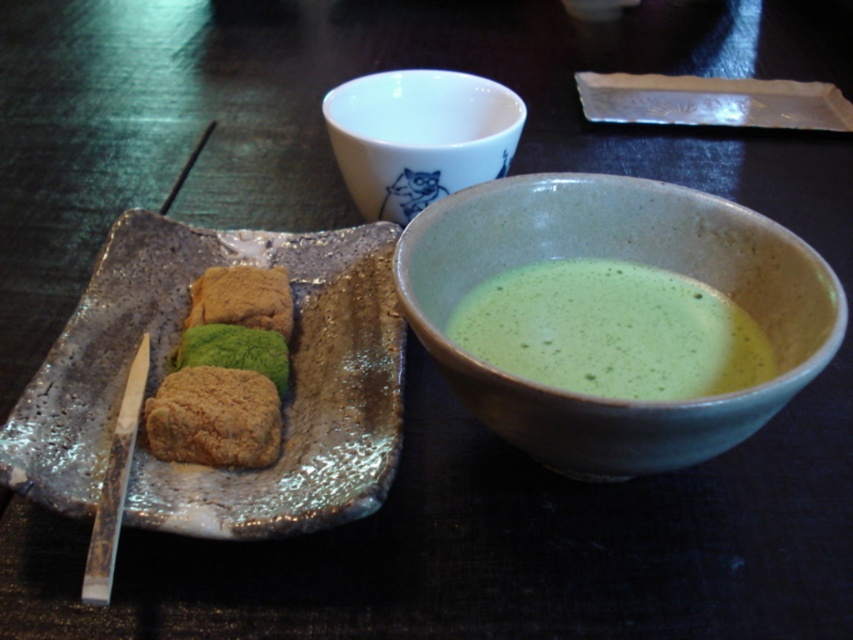
Can you confirm if green matte soup at center is shorter than green matte/soft sponge at center?

Yes, green matte soup at center is shorter than green matte/soft sponge at center.

Who is shorter, green matte soup at center or green matte/soft sponge at center?

green matte soup at center

What are the coordinates of `green matte soup at center` in the screenshot? It's located at (611, 332).

Between green matte/soft sponge at center and brown crumbly pastry at center-left, which one has more height?

green matte/soft sponge at center

In the scene shown: Does green matte/soft sponge at center appear under brown crumbly pastry at center-left?

Actually, green matte/soft sponge at center is above brown crumbly pastry at center-left.

Is point (219, 413) less distant than point (231, 458)?

No, it is not.

Where is `green matte/soft sponge at center`? Image resolution: width=853 pixels, height=640 pixels. green matte/soft sponge at center is located at coordinates (225, 372).

Between green matte soup at center and white ceramic cup at upper center, which one appears on the right side from the viewer's perspective?

Positioned to the right is green matte soup at center.

In the scene shown: Who is more distant from viewer, (647, 296) or (410, 148)?

Positioned behind is point (410, 148).

This screenshot has width=853, height=640. Identify the location of green matte soup at center. (611, 332).